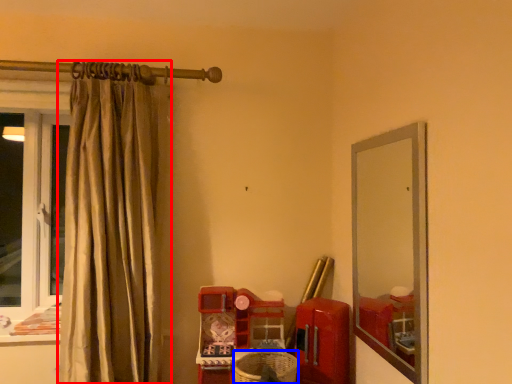
Question: Which of the following is the farthest to the observer, curtain (highlighted by a red box) or basket (highlighted by a blue box)?

Choices:
 (A) curtain
 (B) basket

Answer: (B)